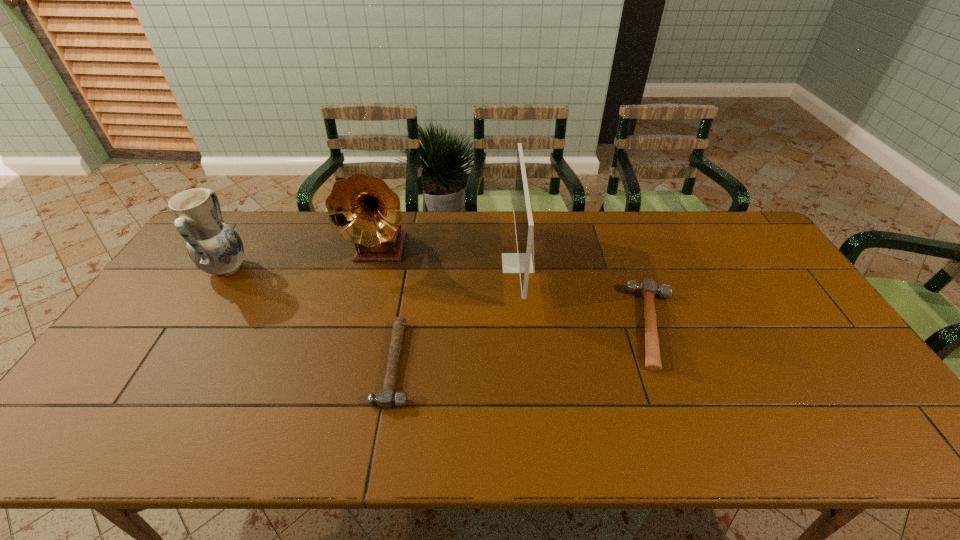
Locate an element on the screen. This screenshot has width=960, height=540. unoccupied position between the phonograph_record and the pottery is located at coordinates (303, 260).

Identify the location of blank region between the pottery and the monitor. This screenshot has width=960, height=540. (372, 266).

What are the coordinates of `empty space between the phonograph_record and the second object from right to left` in the screenshot? It's located at (449, 257).

Image resolution: width=960 pixels, height=540 pixels. What are the coordinates of `vacant space that is in between the second object from right to left and the right hammer` in the screenshot? It's located at (588, 295).

Where is `free space between the second object from right to left and the pottery`? The width and height of the screenshot is (960, 540). free space between the second object from right to left and the pottery is located at coordinates (372, 266).

The height and width of the screenshot is (540, 960). Find the location of `the closest object to the fourth tallest object`. the closest object to the fourth tallest object is located at coordinates (522, 262).

Locate which object ranks fourth in proximity to the phonograph_record. Please provide its 2D coordinates. Your answer should be formatted as a tuple, i.e. [(x, y)], where the tuple contains the x and y coordinates of a point satisfying the conditions above.

[(648, 288)]

You are a GUI agent. You are given a task and a screenshot of the screen. Output one action in this format:
    pyautogui.click(x=<x>, y=<y>)
    Task: Click on the free space that satisfies the following two spatial constraints: 1. on the back side of the right hammer; 2. on either side of the pottery
    
    Given the screenshot: What is the action you would take?
    pyautogui.click(x=635, y=269)

Where is `blank space that satisfies the following two spatial constraints: 1. on either side of the right hammer; 2. on the left side of the pottery`? blank space that satisfies the following two spatial constraints: 1. on either side of the right hammer; 2. on the left side of the pottery is located at coordinates (191, 326).

Identify the location of free space that satisfies the following two spatial constraints: 1. on the front-facing side of the monitor; 2. on the right side of the right hammer. (524, 326).